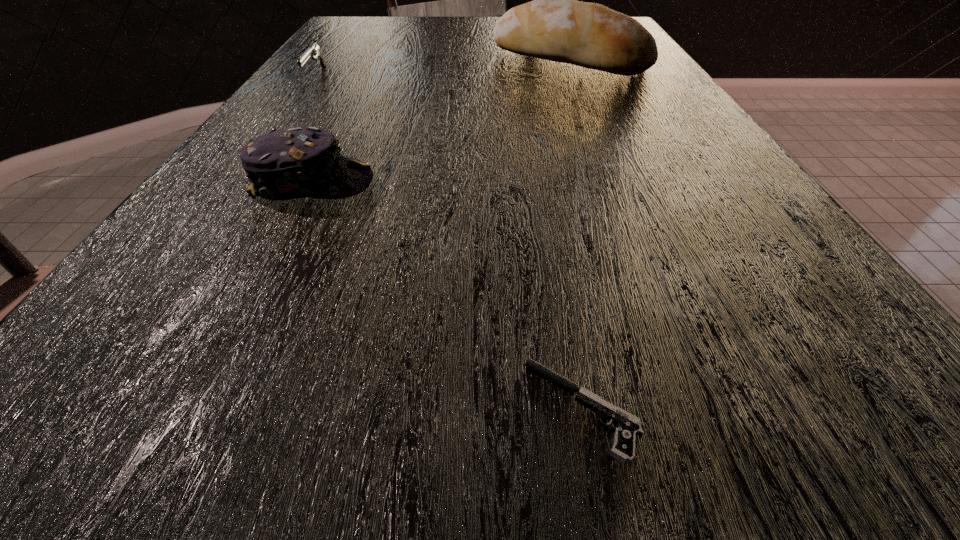
At what (x,y) coordinates should I click in order to perform the action: click on headwear at the left edge. Please return your answer as a coordinate pair (x, y). The width and height of the screenshot is (960, 540). Looking at the image, I should click on (297, 162).

You are a GUI agent. You are given a task and a screenshot of the screen. Output one action in this format:
    pyautogui.click(x=<x>, y=<y>)
    Task: Click on the pistol that is at the left edge
    The width and height of the screenshot is (960, 540).
    Given the screenshot: What is the action you would take?
    pyautogui.click(x=314, y=50)

Find the location of a particular element. The image size is (960, 540). object present at the right edge is located at coordinates (554, 26).

This screenshot has width=960, height=540. In order to click on free location at the far edge in this screenshot , I will do `click(471, 28)`.

In the image, there is a desktop. Where is `free region at the left edge`? This screenshot has height=540, width=960. free region at the left edge is located at coordinates (351, 46).

Locate an element on the screen. vacant space at the right edge of the desktop is located at coordinates (727, 271).

The height and width of the screenshot is (540, 960). Find the location of `vacant space at the far left corner`. vacant space at the far left corner is located at coordinates (377, 29).

At what (x,y) coordinates should I click in order to perform the action: click on vacant point located between the bread and the nearest object. Please return your answer as a coordinate pair (x, y). The height and width of the screenshot is (540, 960). Looking at the image, I should click on (576, 234).

Image resolution: width=960 pixels, height=540 pixels. Find the location of `vacant area that lies between the bread and the shortest pistol`. vacant area that lies between the bread and the shortest pistol is located at coordinates (576, 234).

I want to click on vacant area that lies between the shortest pistol and the bread, so click(576, 234).